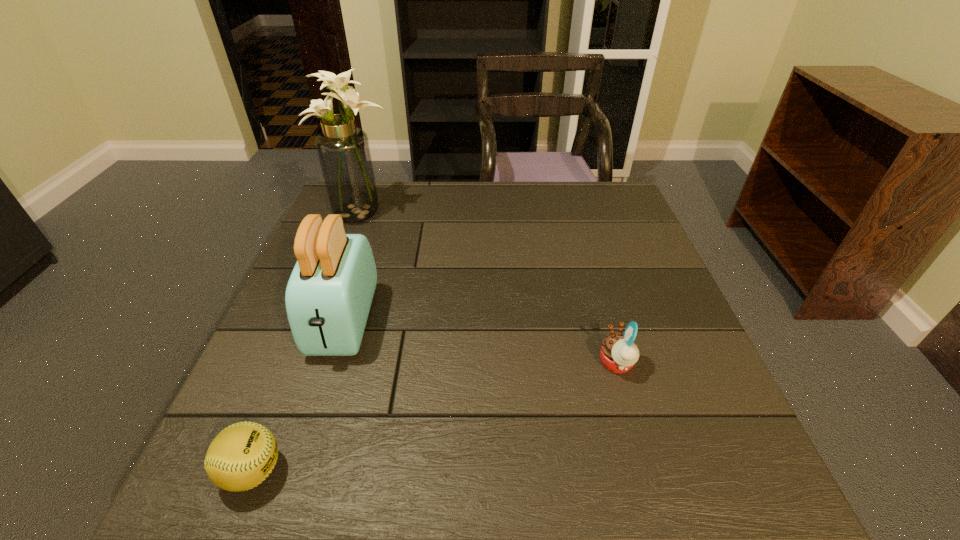
Identify the location of flower arrangement. (343, 150).

Image resolution: width=960 pixels, height=540 pixels. I want to click on the farthest object, so click(343, 150).

At what (x,y) coordinates should I click in order to perform the action: click on the third shortest object. Please return your answer as a coordinate pair (x, y). Looking at the image, I should click on pyautogui.click(x=328, y=297).

You are a GUI agent. You are given a task and a screenshot of the screen. Output one action in this format:
    pyautogui.click(x=<x>, y=<y>)
    Task: Click on the rightmost object
    Image resolution: width=960 pixels, height=540 pixels.
    Given the screenshot: What is the action you would take?
    pyautogui.click(x=618, y=353)

This screenshot has width=960, height=540. I want to click on softball, so click(241, 456).

In order to click on blank space located on the front of the flower arrangement in this screenshot , I will do `click(351, 241)`.

Locate an element on the screen. This screenshot has width=960, height=540. free space located on the side of the second tallest object with the lever is located at coordinates (301, 457).

Locate an element on the screen. This screenshot has width=960, height=540. vacant space located on the front-facing side of the rightmost object is located at coordinates (555, 364).

Where is `free space located 0.050m on the front-facing side of the rightmost object`? Image resolution: width=960 pixels, height=540 pixels. free space located 0.050m on the front-facing side of the rightmost object is located at coordinates (574, 364).

The image size is (960, 540). I want to click on free space located 0.270m on the front-facing side of the rightmost object, so click(467, 364).